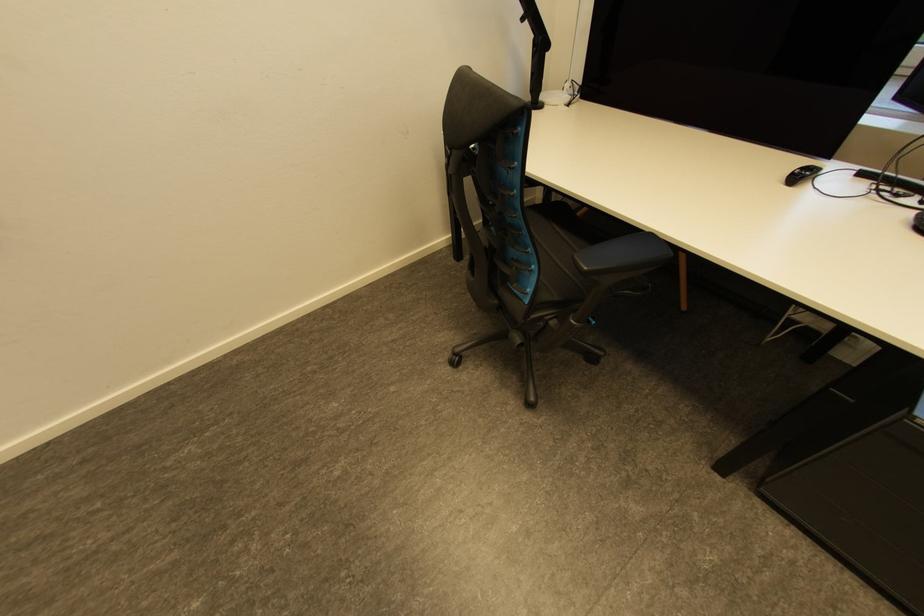
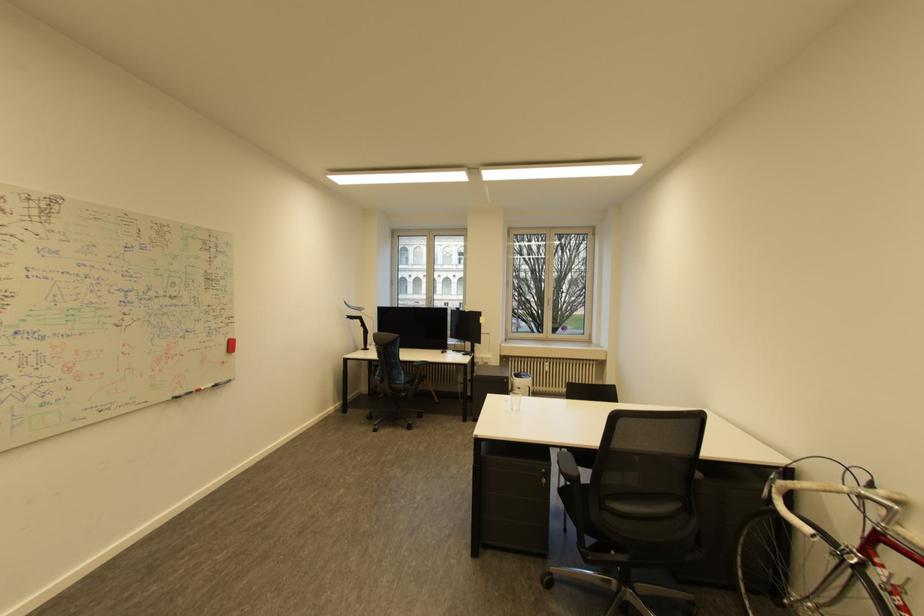
Question: I am providing you with two images of the same scene from different viewpoints. After the viewpoint changes to image2, which objects are now occluded?

Choices:
 (A) cabinet drawer handle
 (B) machine control buttons
 (C) bicycle handlebar
 (D) black computer mouse

Answer: (D)